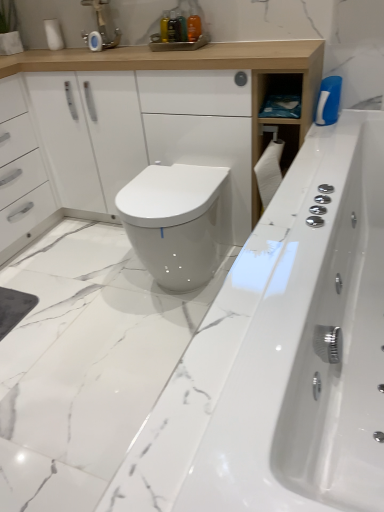
Question: Is matte silver faucet at upper center at the back of white glossy bathtub at center?

Choices:
 (A) no
 (B) yes

Answer: (A)

Question: Is white glossy bathtub at center at the left side of matte silver faucet at upper center?

Choices:
 (A) yes
 (B) no

Answer: (B)

Question: Does white glossy bathtub at center touch matte silver faucet at upper center?

Choices:
 (A) yes
 (B) no

Answer: (B)

Question: From a real-world perspective, is white glossy bathtub at center under matte silver faucet at upper center?

Choices:
 (A) yes
 (B) no

Answer: (A)

Question: From the image's perspective, would you say white glossy bathtub at center is positioned over matte silver faucet at upper center?

Choices:
 (A) yes
 (B) no

Answer: (B)

Question: Is white glossy bathtub at center behind matte silver faucet at upper center?

Choices:
 (A) yes
 (B) no

Answer: (B)

Question: From the image's perspective, is matte silver faucet at upper center beneath white glossy cabinet at upper center?

Choices:
 (A) yes
 (B) no

Answer: (B)

Question: Is matte silver faucet at upper center smaller than white glossy cabinet at upper center?

Choices:
 (A) yes
 (B) no

Answer: (A)

Question: From a real-world perspective, is matte silver faucet at upper center under white glossy cabinet at upper center?

Choices:
 (A) no
 (B) yes

Answer: (A)

Question: Considering the relative positions of matte silver faucet at upper center and white glossy cabinet at upper center in the image provided, is matte silver faucet at upper center to the right of white glossy cabinet at upper center from the viewer's perspective?

Choices:
 (A) no
 (B) yes

Answer: (A)

Question: Considering the relative sizes of matte silver faucet at upper center and white glossy cabinet at upper center in the image provided, is matte silver faucet at upper center taller than white glossy cabinet at upper center?

Choices:
 (A) yes
 (B) no

Answer: (B)

Question: Is matte silver faucet at upper center oriented away from white glossy cabinet at upper center?

Choices:
 (A) no
 (B) yes

Answer: (A)

Question: Is white glossy bathtub at center at the left side of white glossy bidet at center?

Choices:
 (A) no
 (B) yes

Answer: (A)